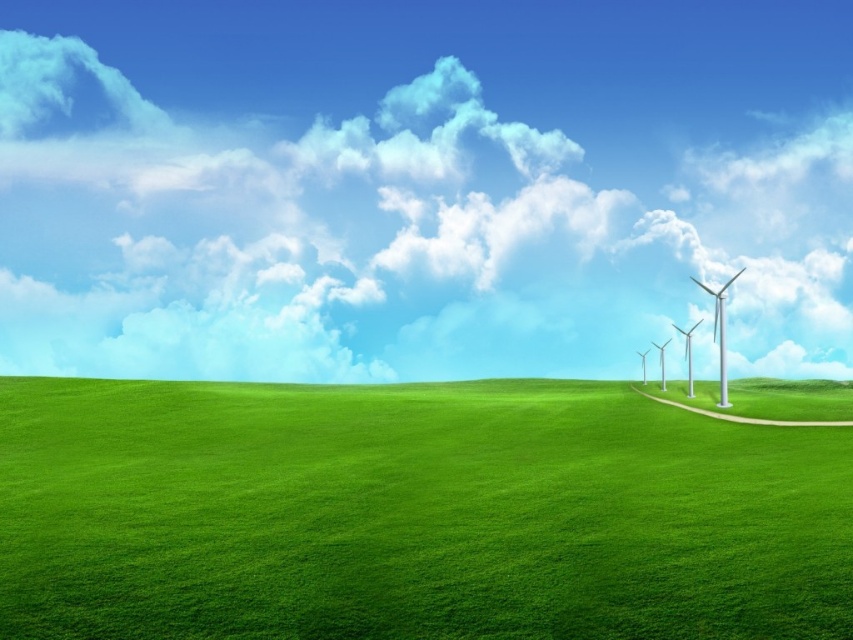
Question: Which object appears farthest from the camera in this image?

Choices:
 (A) metallic silver wind turbine at right
 (B) green grassy field at center
 (C) silver metallic wind turbines at center-right

Answer: (A)

Question: Which of the following is the farthest from the observer?

Choices:
 (A) (670, 339)
 (B) (15, 442)
 (C) (691, 356)

Answer: (A)

Question: Among these objects, which one is nearest to the camera?

Choices:
 (A) white metallic wind turbine at right
 (B) metallic silver wind turbine at right
 (C) silver metallic wind turbines at center-right

Answer: (C)

Question: Does white metallic wind turbine at right appear on the right side of white metallic windmill at center-right?

Choices:
 (A) no
 (B) yes

Answer: (A)

Question: Is green grassy field at center bigger than metallic silver wind turbine at right?

Choices:
 (A) no
 (B) yes

Answer: (B)

Question: Can you confirm if metallic silver wind turbine at right is positioned to the right of white metallic windmill at center-right?

Choices:
 (A) no
 (B) yes

Answer: (A)